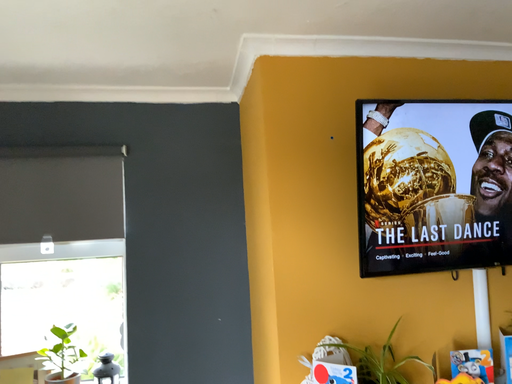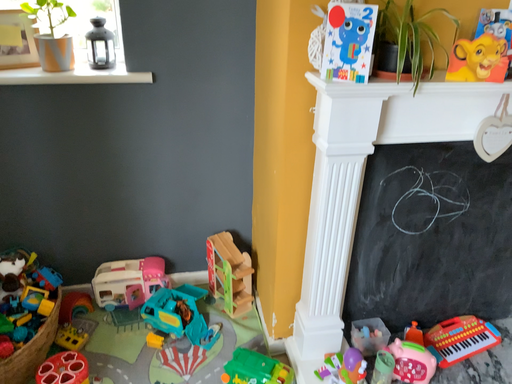
Question: Which way did the camera rotate in the video?

Choices:
 (A) rotated downward
 (B) rotated upward

Answer: (A)